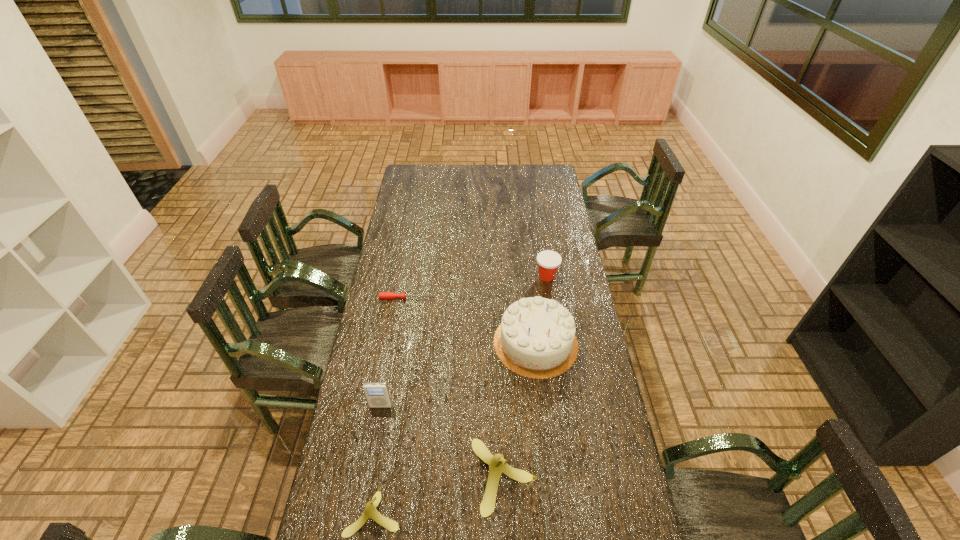
Where is `vacant region located at the tip of the screwdriver`? vacant region located at the tip of the screwdriver is located at coordinates (515, 298).

In order to click on vacant position located 0.320m on the front of the third farthest object in this screenshot , I will do `click(550, 468)`.

Image resolution: width=960 pixels, height=540 pixels. In order to click on vacant space positioned on the front-facing side of the third nearest object in this screenshot , I will do `click(370, 469)`.

You are a GUI agent. You are given a task and a screenshot of the screen. Output one action in this format:
    pyautogui.click(x=<x>, y=<y>)
    Task: Click on the banana that is at the left edge
    The height and width of the screenshot is (540, 960).
    Given the screenshot: What is the action you would take?
    pyautogui.click(x=370, y=511)

This screenshot has width=960, height=540. I want to click on screwdriver located at the left edge, so click(x=382, y=295).

The height and width of the screenshot is (540, 960). Find the location of `iPod that is at the left edge`. iPod that is at the left edge is located at coordinates (377, 394).

The height and width of the screenshot is (540, 960). I want to click on Dixie cup that is at the right edge, so click(548, 261).

The width and height of the screenshot is (960, 540). Find the location of `birthday cake at the right edge`. birthday cake at the right edge is located at coordinates (536, 338).

In order to click on object at the near left corner in this screenshot , I will do `click(370, 511)`.

In the image, there is a desktop. Where is `vacant space at the far edge`? The height and width of the screenshot is (540, 960). vacant space at the far edge is located at coordinates (472, 175).